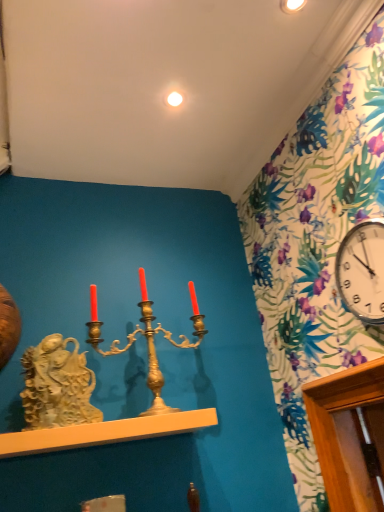
Question: Is white glossy clock at upper right turned away from white glossy light bulb at upper center?

Choices:
 (A) no
 (B) yes

Answer: (A)

Question: Considering the relative sizes of white glossy clock at upper right and white glossy light bulb at upper center in the image provided, is white glossy clock at upper right taller than white glossy light bulb at upper center?

Choices:
 (A) yes
 (B) no

Answer: (A)

Question: Does white glossy clock at upper right have a greater width compared to white glossy light bulb at upper center?

Choices:
 (A) no
 (B) yes

Answer: (A)

Question: Is white glossy clock at upper right shorter than white glossy light bulb at upper center?

Choices:
 (A) yes
 (B) no

Answer: (B)

Question: Does white glossy clock at upper right have a smaller size compared to white glossy light bulb at upper center?

Choices:
 (A) no
 (B) yes

Answer: (A)

Question: Considering the positions of white glossy clock at upper right and gold metallic candle holder at center in the image, is white glossy clock at upper right bigger or smaller than gold metallic candle holder at center?

Choices:
 (A) small
 (B) big

Answer: (A)

Question: Based on their positions, is white glossy clock at upper right located to the left or right of gold metallic candle holder at center?

Choices:
 (A) right
 (B) left

Answer: (A)

Question: Would you say white glossy clock at upper right is inside or outside gold metallic candle holder at center?

Choices:
 (A) inside
 (B) outside

Answer: (B)

Question: From their relative heights in the image, would you say white glossy clock at upper right is taller or shorter than gold metallic candle holder at center?

Choices:
 (A) short
 (B) tall

Answer: (A)

Question: Is gold metallic candle holder at center inside the boundaries of white glossy light bulb at upper center, or outside?

Choices:
 (A) inside
 (B) outside

Answer: (B)

Question: Visually, is gold metallic candle holder at center positioned to the left or to the right of white glossy light bulb at upper center?

Choices:
 (A) left
 (B) right

Answer: (A)

Question: Considering the positions of gold metallic candle holder at center and white glossy light bulb at upper center in the image, is gold metallic candle holder at center taller or shorter than white glossy light bulb at upper center?

Choices:
 (A) short
 (B) tall

Answer: (B)

Question: From a real-world perspective, is gold metallic candle holder at center positioned above or below white glossy light bulb at upper center?

Choices:
 (A) below
 (B) above

Answer: (A)

Question: Does point (x=195, y=415) appear closer or farther from the camera than point (x=352, y=300)?

Choices:
 (A) closer
 (B) farther

Answer: (B)

Question: Is smooth white shelf at center in front of or behind white glossy clock at upper right in the image?

Choices:
 (A) front
 (B) behind

Answer: (B)